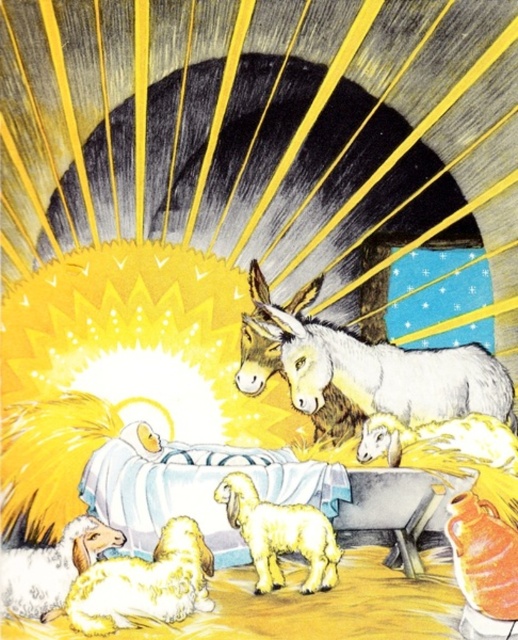
Is fluffy white sheep at lower left taller than fluffy white lamb at center?

In fact, fluffy white sheep at lower left may be shorter than fluffy white lamb at center.

Can you confirm if fluffy white sheep at lower left is wider than fluffy white lamb at center?

Correct, the width of fluffy white sheep at lower left exceeds that of fluffy white lamb at center.

Is point (184, 557) less distant than point (300, 520)?

Yes.

Image resolution: width=518 pixels, height=640 pixels. I want to click on fluffy white sheep at lower left, so click(x=145, y=582).

Does white textured donkey at center lie in front of white woolen sheep at lower left?

That is False.

Between point (406, 381) and point (48, 561), which one is positioned in front?

Positioned in front is point (48, 561).

Locate an element on the screen. The image size is (518, 640). white textured donkey at center is located at coordinates (369, 369).

Does white textured donkey at center have a lesser width compared to fluffy white sheep at lower left?

In fact, white textured donkey at center might be wider than fluffy white sheep at lower left.

Locate an element on the screen. white textured donkey at center is located at coordinates (369, 369).